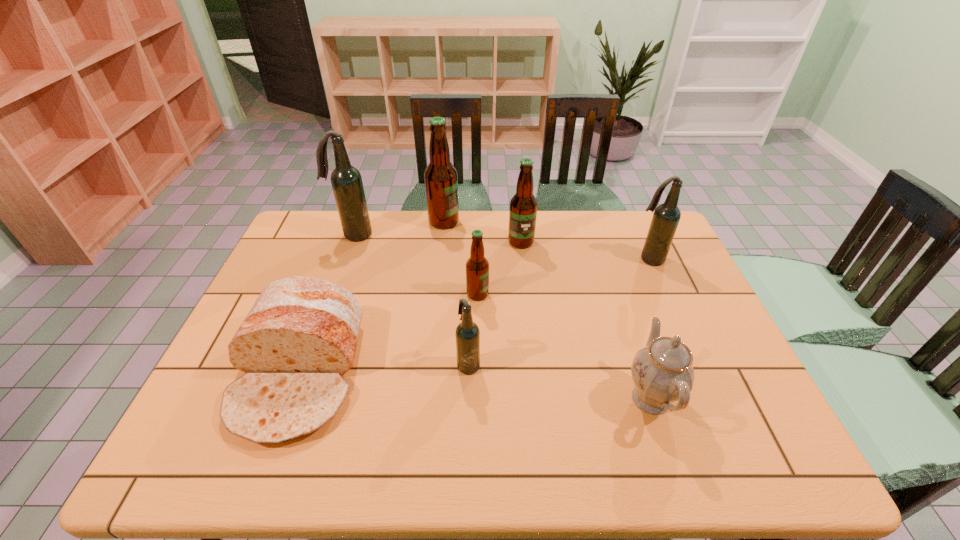
Identify which brown beer bottle is located as the second nearest to the smallest brown beer bottle. Please provide its 2D coordinates. Your answer should be formatted as a tuple, i.e. [(x, y)], where the tuple contains the x and y coordinates of a point satisfying the conditions above.

[(441, 181)]

Find the location of a particular element. The image size is (960, 540). brown beer bottle that can be found as the second closest to the second farthest brown beer bottle is located at coordinates (477, 266).

Identify which dark beer bottle is located as the second nearest to the second beer bottle from right to left. Please provide its 2D coordinates. Your answer should be formatted as a tuple, i.e. [(x, y)], where the tuple contains the x and y coordinates of a point satisfying the conditions above.

[(467, 333)]

Select which dark beer bottle appears as the third closest to the bread. Please provide its 2D coordinates. Your answer should be formatted as a tuple, i.e. [(x, y)], where the tuple contains the x and y coordinates of a point satisfying the conditions above.

[(666, 217)]

Where is `free region that satisfies the following two spatial constraints: 1. on the label of the leftmost brown beer bottle; 2. on the front side of the leftmost beer bottle`? The image size is (960, 540). free region that satisfies the following two spatial constraints: 1. on the label of the leftmost brown beer bottle; 2. on the front side of the leftmost beer bottle is located at coordinates (443, 234).

This screenshot has height=540, width=960. What are the coordinates of `vacant space that satisfies the following two spatial constraints: 1. on the label of the second nearest brown beer bottle; 2. on the label of the fifth farthest beer bottle` in the screenshot? It's located at (527, 294).